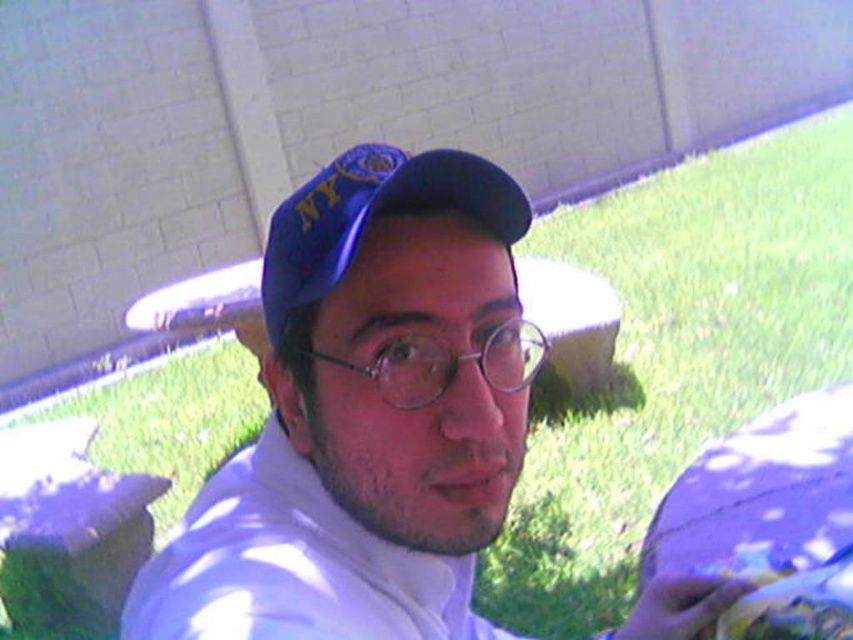
Question: Which point is closer to the camera?

Choices:
 (A) white matte shirt at center
 (B) blue fabric cap at center

Answer: (A)

Question: Does white matte shirt at center lie in front of blue fabric cap at center?

Choices:
 (A) no
 (B) yes

Answer: (B)

Question: Is white matte shirt at center in front of blue fabric cap at center?

Choices:
 (A) yes
 (B) no

Answer: (A)

Question: Does white matte shirt at center appear under blue fabric cap at center?

Choices:
 (A) yes
 (B) no

Answer: (A)

Question: Among these points, which one is farthest from the camera?

Choices:
 (A) (297, 195)
 (B) (268, 433)

Answer: (B)

Question: Which object appears closest to the camera in this image?

Choices:
 (A) blue fabric cap at center
 (B) white matte shirt at center

Answer: (B)